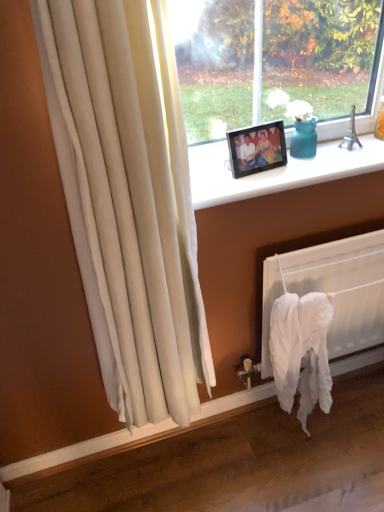
Question: Is black plastic frame at upper center facing away from black plastic picture frame at upper center?

Choices:
 (A) yes
 (B) no

Answer: (B)

Question: Can we say black plastic frame at upper center lies outside black plastic picture frame at upper center?

Choices:
 (A) no
 (B) yes

Answer: (B)

Question: Is black plastic picture frame at upper center surrounded by black plastic frame at upper center?

Choices:
 (A) yes
 (B) no

Answer: (B)

Question: Can you confirm if black plastic frame at upper center is taller than black plastic picture frame at upper center?

Choices:
 (A) no
 (B) yes

Answer: (A)

Question: Considering the relative sizes of black plastic frame at upper center and black plastic picture frame at upper center in the image provided, is black plastic frame at upper center bigger than black plastic picture frame at upper center?

Choices:
 (A) yes
 (B) no

Answer: (A)

Question: From the image's perspective, is white fabric at lower right above or below black plastic frame at upper center?

Choices:
 (A) above
 (B) below

Answer: (B)

Question: From a real-world perspective, is white fabric at lower right above or below black plastic frame at upper center?

Choices:
 (A) below
 (B) above

Answer: (A)

Question: Does point (352, 330) appear closer or farther from the camera than point (213, 183)?

Choices:
 (A) closer
 (B) farther

Answer: (B)

Question: Is white fabric at lower right in front of or behind black plastic frame at upper center in the image?

Choices:
 (A) front
 (B) behind

Answer: (B)

Question: From the image's perspective, is black plastic frame at upper center located above or below black plastic picture frame at upper center?

Choices:
 (A) above
 (B) below

Answer: (B)

Question: Is black plastic frame at upper center wider or thinner than black plastic picture frame at upper center?

Choices:
 (A) thin
 (B) wide

Answer: (B)

Question: Is point click(324, 146) positioned closer to the camera than point click(253, 128)?

Choices:
 (A) closer
 (B) farther

Answer: (B)

Question: Is black plastic frame at upper center in front of or behind black plastic picture frame at upper center in the image?

Choices:
 (A) behind
 (B) front

Answer: (B)

Question: Looking at their shapes, would you say black plastic frame at upper center is wider or thinner than white fabric at lower right?

Choices:
 (A) wide
 (B) thin

Answer: (A)

Question: Is black plastic frame at upper center spatially inside white fabric at lower right, or outside of it?

Choices:
 (A) outside
 (B) inside

Answer: (A)